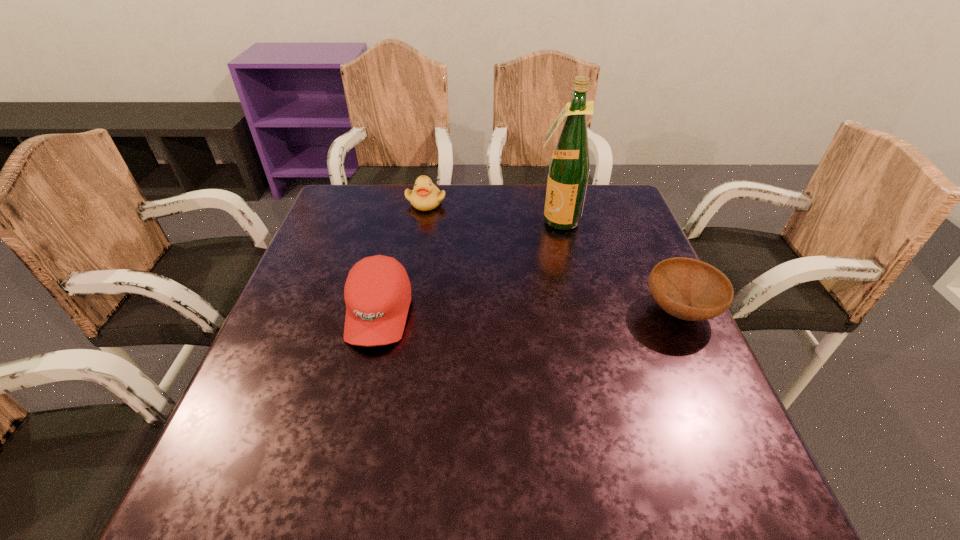
This screenshot has height=540, width=960. I want to click on free point at the right edge, so pos(614,335).

Locate an element on the screen. The image size is (960, 540). vacant space at the far left corner of the desktop is located at coordinates (365, 228).

Image resolution: width=960 pixels, height=540 pixels. I want to click on free region at the far right corner, so click(x=585, y=202).

Locate an element on the screen. The image size is (960, 540). free spot between the duckling and the bowl is located at coordinates (553, 256).

The image size is (960, 540). What are the coordinates of `vacant area that lies between the duckling and the tallest object` in the screenshot? It's located at (492, 212).

The image size is (960, 540). Identify the location of blank region between the bowl and the duckling. (553, 256).

I want to click on empty space that is in between the cap and the second object from right to left, so click(x=468, y=267).

You are a GUI agent. You are given a task and a screenshot of the screen. Output one action in this format:
    pyautogui.click(x=<x>, y=<y>)
    Task: Click on the free spot between the liquor and the duckling
    This screenshot has width=960, height=540.
    Given the screenshot: What is the action you would take?
    pyautogui.click(x=492, y=212)

I want to click on free point between the second object from right to left and the cap, so click(x=468, y=267).

Locate an element on the screen. vacant space that's between the bowl and the duckling is located at coordinates (553, 256).